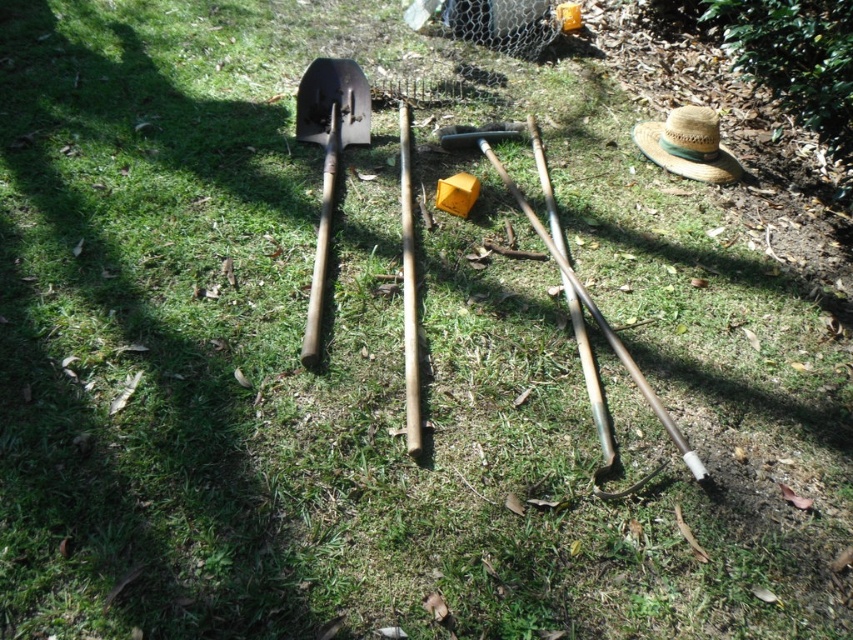
At what (x,y) coordinates should I click in order to perform the action: click on wooden shovel at center. Please return your answer as a coordinate pair (x, y). The width and height of the screenshot is (853, 640). Looking at the image, I should click on (328, 160).

Does wooden shovel at center have a lesser height compared to wooden baseball bat at center?

Indeed, wooden shovel at center has a lesser height compared to wooden baseball bat at center.

Is point (334, 120) closer to camera compared to point (403, 253)?

No, (334, 120) is further to viewer.

Identify the location of wooden shovel at center. click(x=328, y=160).

Based on the photo, can you confirm if straw hat at lower right is wider than wooden baseball bat at center?

Yes.

Between point (656, 163) and point (405, 218), which one is positioned behind?

The point (656, 163) is more distant.

Where is `straw hat at lower right`? The image size is (853, 640). straw hat at lower right is located at coordinates (688, 145).

Who is taller, wooden shovel at center or straw hat at lower right?

Standing taller between the two is wooden shovel at center.

Which is below, wooden shovel at center or straw hat at lower right?

wooden shovel at center is below.

Is point (316, 97) closer to camera compared to point (724, 179)?

No.

The height and width of the screenshot is (640, 853). I want to click on wooden shovel at center, so 328,160.